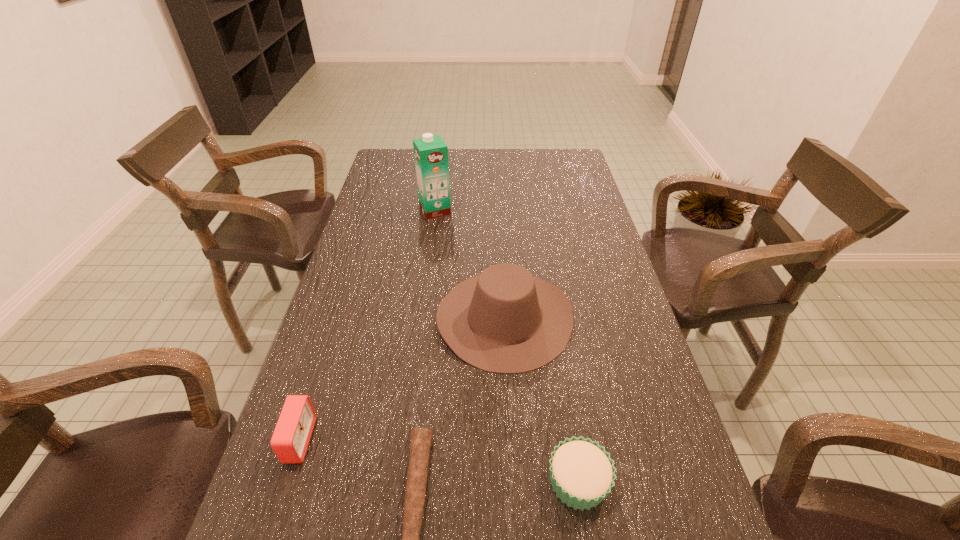
Identify the location of free spot located on the back of the cupcake. (568, 424).

At what (x,y) coordinates should I click in order to perform the action: click on object situated at the left edge. Please return your answer as a coordinate pair (x, y). Image resolution: width=960 pixels, height=540 pixels. Looking at the image, I should click on (290, 440).

Image resolution: width=960 pixels, height=540 pixels. In order to click on object located at the right edge in this screenshot , I will do `click(582, 474)`.

Where is `vacant region at the far edge`? The width and height of the screenshot is (960, 540). vacant region at the far edge is located at coordinates (535, 171).

You are a GUI agent. You are given a task and a screenshot of the screen. Output one action in this format:
    pyautogui.click(x=<x>, y=<y>)
    Task: Click on the vacant space at the left edge
    
    Given the screenshot: What is the action you would take?
    pyautogui.click(x=299, y=480)

The image size is (960, 540). Find the location of `vacant region at the right edge of the desktop`. vacant region at the right edge of the desktop is located at coordinates (625, 425).

Where is `vacant area that lies between the second shortest object and the second farthest object`? This screenshot has width=960, height=540. vacant area that lies between the second shortest object and the second farthest object is located at coordinates (541, 400).

Where is `empty space between the carton and the leftmost object`? empty space between the carton and the leftmost object is located at coordinates (367, 325).

This screenshot has width=960, height=540. What are the coordinates of `vacant space that is in between the fourth shortest object and the tallest object` in the screenshot? It's located at (469, 264).

Locate an element on the screen. The image size is (960, 540). vacant area that lies between the second tallest object and the tallest object is located at coordinates (469, 264).